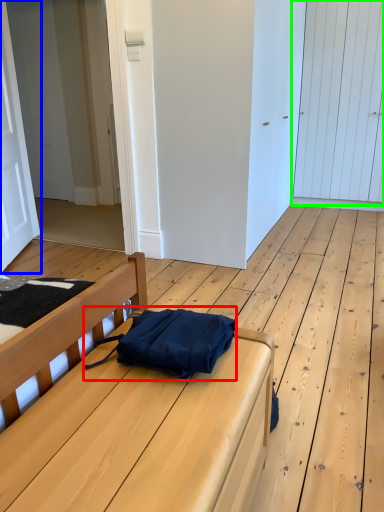
Question: Considering the real-world distances, which object is closest to messenger bag (highlighted by a red box)? door (highlighted by a blue box) or door (highlighted by a green box).

Choices:
 (A) door
 (B) door

Answer: (A)